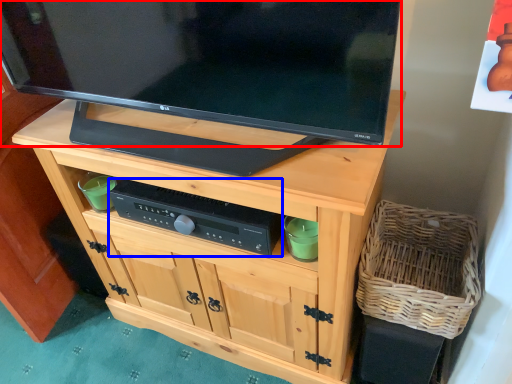
Question: Which point is closer to the camera, television (highlighted by a red box) or control (highlighted by a blue box)?

Choices:
 (A) television
 (B) control

Answer: (A)